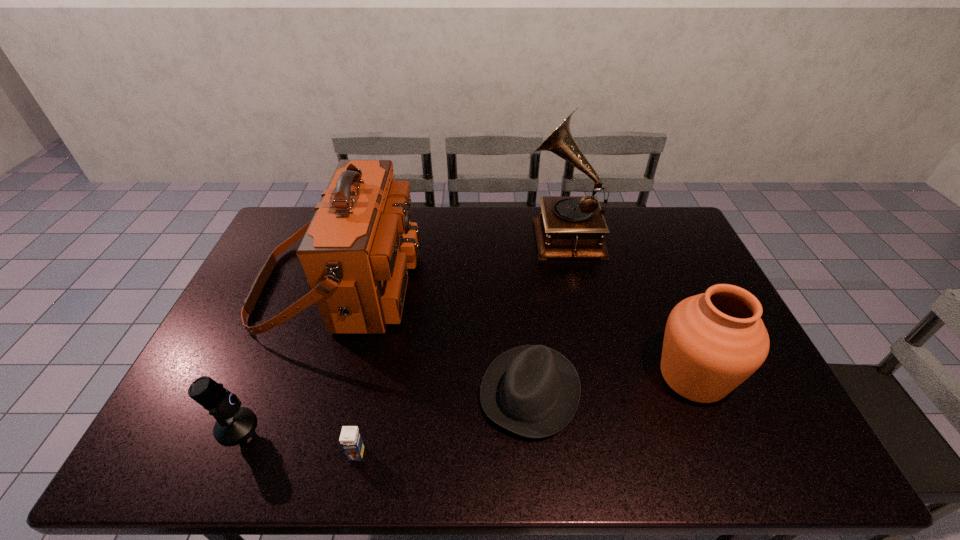
Locate an element on the screen. This screenshot has height=540, width=960. microphone present at the left edge is located at coordinates (233, 423).

Locate an element on the screen. This screenshot has width=960, height=540. object present at the right edge is located at coordinates (714, 341).

Where is `object at the far left corner`? object at the far left corner is located at coordinates (356, 251).

Image resolution: width=960 pixels, height=540 pixels. What are the coordinates of `object that is at the near left corner` in the screenshot? It's located at (233, 423).

In the image, there is a desktop. Where is `vacant space at the far edge`? The height and width of the screenshot is (540, 960). vacant space at the far edge is located at coordinates (633, 217).

Identify the location of vacant space at the near edge. (241, 462).

Locate an element on the screen. vacant space at the left edge of the desktop is located at coordinates (237, 316).

Locate an element on the screen. The image size is (960, 540). vacant space at the far right corner of the desktop is located at coordinates (665, 211).

Image resolution: width=960 pixels, height=540 pixels. In order to click on unoccupied area between the record player and the microphone in this screenshot , I will do `click(398, 329)`.

Where is `free space between the urn and the microphone`? free space between the urn and the microphone is located at coordinates click(x=465, y=401).